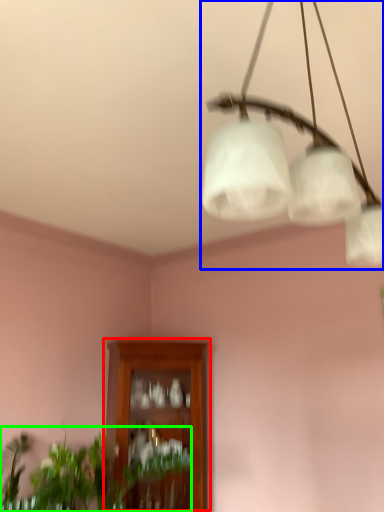
Question: Considering the real-world distances, which object is closest to cabinetry (highlighted by a red box)? lamp (highlighted by a blue box) or houseplant (highlighted by a green box).

Choices:
 (A) lamp
 (B) houseplant

Answer: (B)